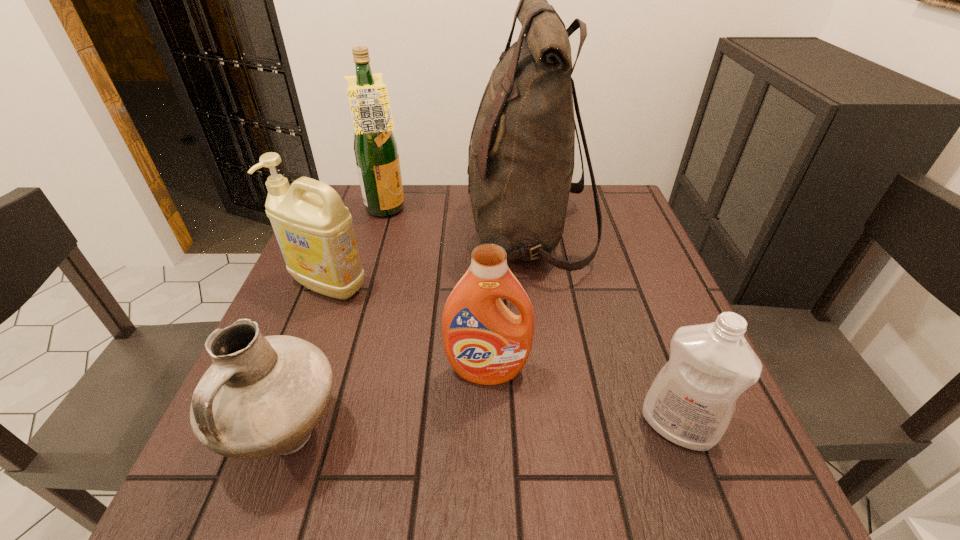
Locate an element on the screen. This screenshot has width=960, height=540. pitcher that is positioned at the left edge is located at coordinates (262, 396).

This screenshot has height=540, width=960. I want to click on backpack at the right edge, so click(521, 154).

Find the location of a particular element. This screenshot has height=540, width=960. detergent located in the right edge section of the desktop is located at coordinates (691, 402).

The height and width of the screenshot is (540, 960). I want to click on object that is at the far left corner, so tap(375, 147).

You are a GUI agent. You are given a task and a screenshot of the screen. Output one action in this format:
    pyautogui.click(x=<x>, y=<y>)
    Task: Click on the object that is at the near left corner
    This screenshot has width=960, height=540.
    Given the screenshot: What is the action you would take?
    click(262, 396)

Find the location of a particular element. object positioned at the far right corner is located at coordinates (521, 154).

Locate an element on the screen. This screenshot has height=540, width=960. free region at the far edge of the desktop is located at coordinates (426, 215).

In order to click on vacant space at the near edge in this screenshot , I will do [450, 478].

The height and width of the screenshot is (540, 960). In the image, there is a desktop. Identify the location of vacant space at the left edge. (314, 321).

You are a GUI agent. You are given a task and a screenshot of the screen. Output one action in this format:
    pyautogui.click(x=<x>, y=<y>)
    Task: Click on the free spot at the right edge of the desktop
    The image size is (960, 540).
    Given the screenshot: What is the action you would take?
    pyautogui.click(x=657, y=326)